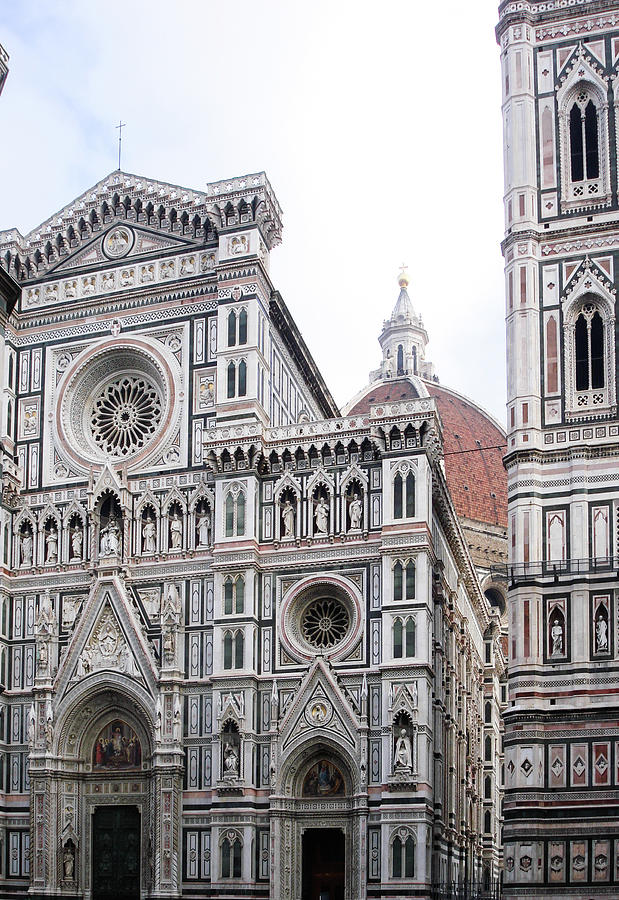
Find the location of `doorways`. doorways is located at coordinates (122, 826), (332, 865).